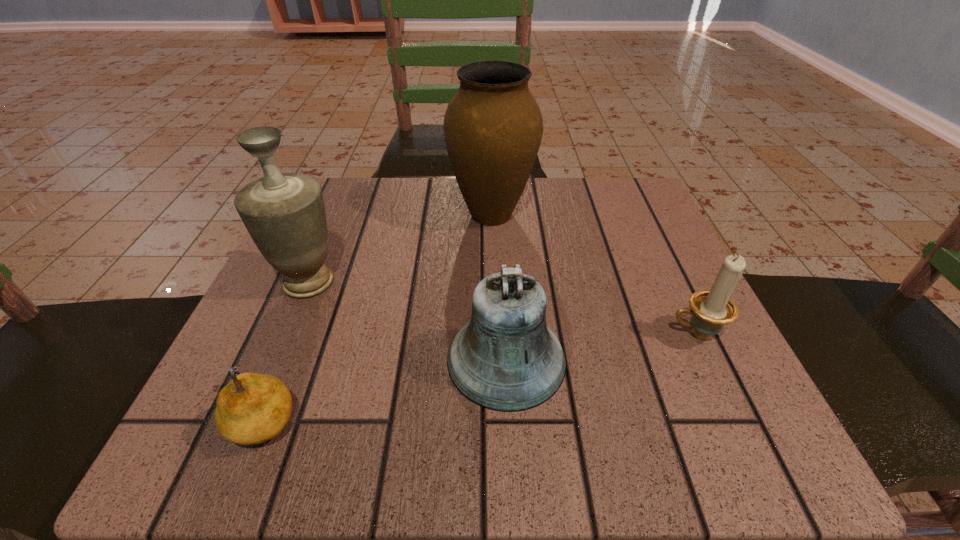
Identify the location of vacant space that is in between the nearer urn and the bell. coord(407,321).

At what (x,y) coordinates should I click in order to perform the action: click on free space that is in between the bell and the nearer urn. Please return your answer as a coordinate pair (x, y). The height and width of the screenshot is (540, 960). Looking at the image, I should click on (407, 321).

At what (x,y) coordinates should I click in order to perform the action: click on vacant area that lies between the farthest object and the rightmost object. Please return your answer as a coordinate pair (x, y). The height and width of the screenshot is (540, 960). Looking at the image, I should click on (593, 274).

At what (x,y) coordinates should I click in order to perform the action: click on free area in between the bell and the shortest object. Please return your answer as a coordinate pair (x, y). The image size is (960, 540). Looking at the image, I should click on [385, 389].

At what (x,y) coordinates should I click in order to perform the action: click on object that is the fourth closest to the nearer urn. Please return your answer as a coordinate pair (x, y). The width and height of the screenshot is (960, 540). Looking at the image, I should click on (711, 309).

The height and width of the screenshot is (540, 960). I want to click on object that stands as the fourth closest to the right urn, so click(253, 408).

In order to click on blank space that satisfies the following two spatial constraints: 1. on the front side of the bell; 2. on the left side of the right urn in this screenshot , I will do pos(496,359).

The height and width of the screenshot is (540, 960). I want to click on vacant space that satisfies the following two spatial constraints: 1. on the back side of the pear; 2. on the right side of the bell, so click(288, 359).

Locate an element on the screen. vacant space that satisfies the following two spatial constraints: 1. on the front side of the right urn; 2. on the right side of the bell is located at coordinates (496, 359).